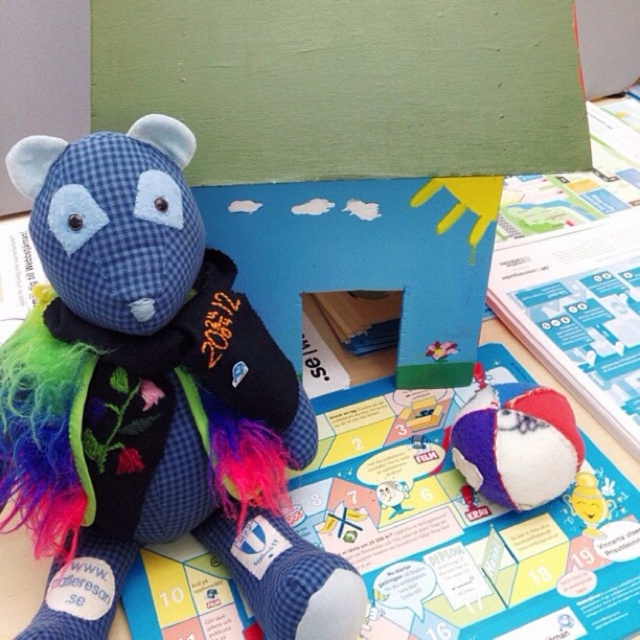
Question: Does blue checkered fabric teddy bear at center have a larger size compared to textured fabric ball at lower right?

Choices:
 (A) yes
 (B) no

Answer: (A)

Question: Which point is farther from the camera taking this photo?

Choices:
 (A) (182, 182)
 (B) (538, 392)

Answer: (B)

Question: Can you confirm if blue checkered fabric teddy bear at center is bigger than textured fabric ball at lower right?

Choices:
 (A) yes
 (B) no

Answer: (A)

Question: Does blue checkered fabric teddy bear at center appear on the left side of textured fabric ball at lower right?

Choices:
 (A) yes
 (B) no

Answer: (A)